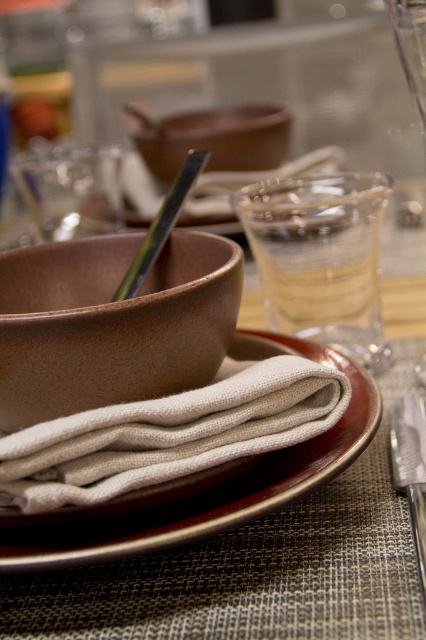
You are setting up a dining table and need to place a decorative item on top of the brown matte bowl at center and brown matte plate at center. Which object can you place the item on so it stays stable?

The brown matte bowl at center has a greater height compared to brown matte plate at center, so placing the item on the brown matte plate at center would be more stable as it has a flatter surface.

You are setting up a formal dinner and need to place a decorative centerpiece between the brown matte plate at center and the matte brown bowl at center. Based on their positions, where should you place the centerpiece?

The brown matte plate at center is to the right of the matte brown bowl at center, so the centerpiece should be placed between them, centered between the two items.

You are at the point labeled point (60, 307) and want to reach the edge of the dining table. The table is 6 feet long. Can you walk straight ahead to the edge?

The distance between point (60, 307) and the edge of the dining table is 14.55 inches. Since the table is 6 feet long, which is 72 inches, you can walk straight ahead to the edge as the distance is less than the table length.